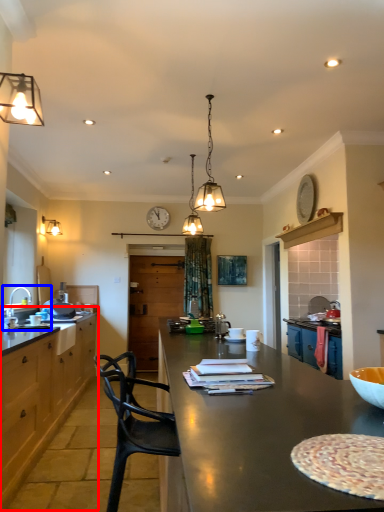
Question: Which object appears farthest to the camera in this image, cabinetry (highlighted by a red box) or sink (highlighted by a blue box)?

Choices:
 (A) cabinetry
 (B) sink

Answer: (B)